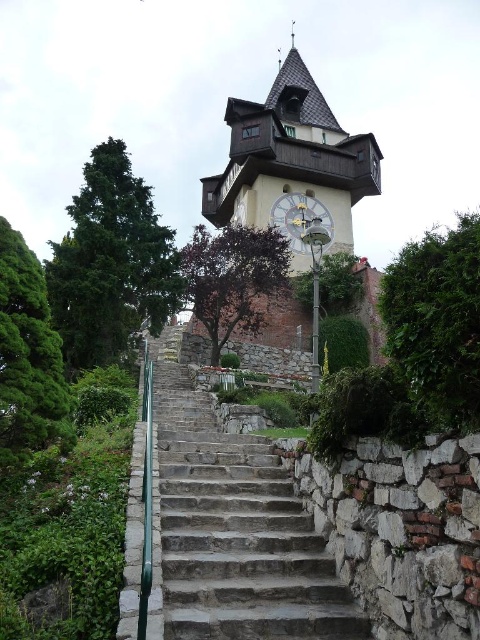
You are standing at the base of the stone staircase leading to the historic clock tower. You want to take a photo of the clock tower with the green leafy tree at right in the background. Based on their positions, will the tree be fully visible in the photo if you frame the tower centrally?

The green leafy tree at right is positioned at point [436,321], which is near the center of the image. If you frame the clock tower centrally, the tree should be fully visible in the background as its coordinates suggest it is not overlapping with the tower itself.

You are a hiker planning to take a photo of the historic clock tower. You want to ensure both the green leafy tree at right and the purple leafy tree at center are in the frame. Which tree should you focus on to include both in your photo without cropping either?

To include both the green leafy tree at right and the purple leafy tree at center in the photo without cropping, focus on the purple leafy tree at center since it occupies more space and can help frame the scene effectively.